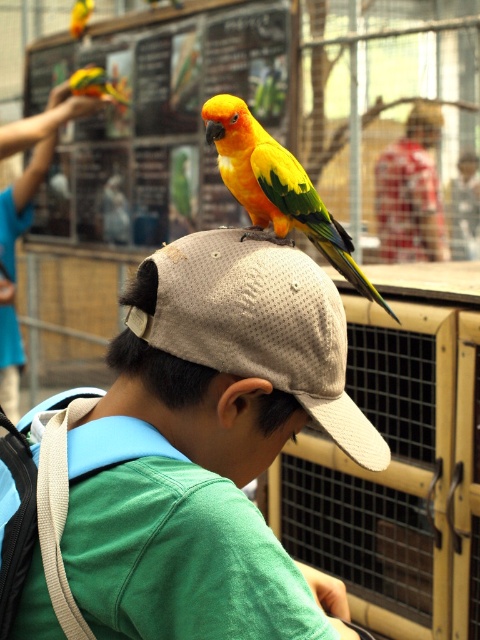
Is point (231, 236) positioned before point (288, 168)?

Yes, point (231, 236) is closer to viewer.

Is beige mesh baseball cap at center above yellow-green parrot at center?

No.

In order to click on beige mesh baseball cap at center in this screenshot , I will do `click(260, 326)`.

What do you see at coordinates (207, 445) in the screenshot?
I see `matte khaki cap at center` at bounding box center [207, 445].

This screenshot has height=640, width=480. What do you see at coordinates (207, 445) in the screenshot?
I see `matte khaki cap at center` at bounding box center [207, 445].

Locate an element on the screen. The image size is (480, 640). matte khaki cap at center is located at coordinates (207, 445).

Which is in front, point (286, 589) or point (225, 164)?

Point (286, 589) is more forward.

Can you confirm if matte khaki cap at center is positioned below yellow-green parrot at center?

Yes, matte khaki cap at center is below yellow-green parrot at center.

Is point (336, 384) positioned behind point (228, 129)?

No.

Locate an element on the screen. This screenshot has height=640, width=480. matte khaki cap at center is located at coordinates (207, 445).